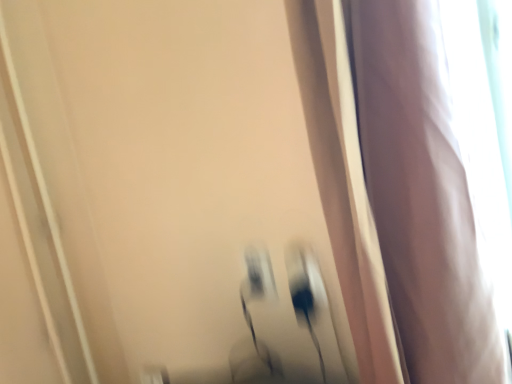
You are a GUI agent. You are given a task and a screenshot of the screen. Output one action in this format:
    pyautogui.click(x=<x>, y=<y>)
    Task: Click on the pink fabric curtain at right
    Image resolution: width=512 pixels, height=384 pixels.
    Given the screenshot: What is the action you would take?
    pyautogui.click(x=421, y=193)

The height and width of the screenshot is (384, 512). Describe the element at coordinates (421, 193) in the screenshot. I see `pink fabric curtain at right` at that location.

You are a GUI agent. You are given a task and a screenshot of the screen. Output one action in this format:
    pyautogui.click(x=<x>, y=<y>)
    Task: Click on the pink fabric curtain at right
    This screenshot has width=512, height=384.
    Given the screenshot: What is the action you would take?
    pyautogui.click(x=421, y=193)